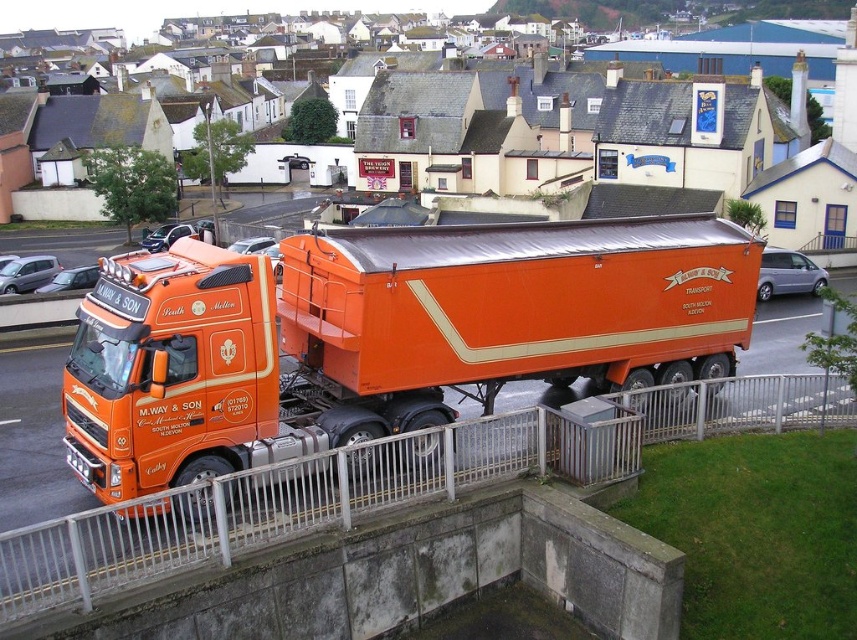
Question: Which object appears farthest from the camera in this image?

Choices:
 (A) orange matte trailer truck at center
 (B) metallic silver rail at lower center

Answer: (A)

Question: Which object appears farthest from the camera in this image?

Choices:
 (A) orange matte trailer truck at center
 (B) metallic silver rail at lower center

Answer: (A)

Question: Can you confirm if orange matte trailer truck at center is bigger than metallic silver rail at lower center?

Choices:
 (A) no
 (B) yes

Answer: (B)

Question: Can you confirm if orange matte trailer truck at center is smaller than metallic silver rail at lower center?

Choices:
 (A) yes
 (B) no

Answer: (B)

Question: Among these objects, which one is nearest to the camera?

Choices:
 (A) metallic silver rail at lower center
 (B) orange matte trailer truck at center

Answer: (A)

Question: Is orange matte trailer truck at center positioned before metallic silver rail at lower center?

Choices:
 (A) yes
 (B) no

Answer: (B)